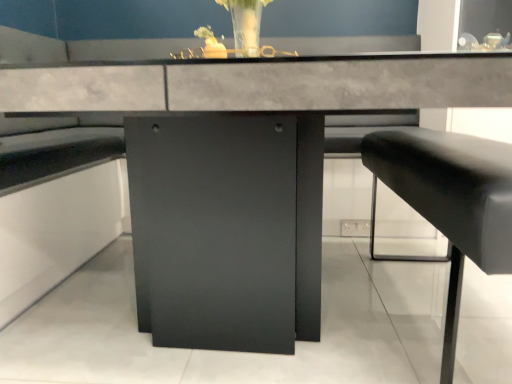
Question: From the image's perspective, is translucent glass vase at upper center above or below black leather cushion at right?

Choices:
 (A) above
 (B) below

Answer: (A)

Question: Based on their sizes in the image, would you say translucent glass vase at upper center is bigger or smaller than black leather cushion at right?

Choices:
 (A) small
 (B) big

Answer: (A)

Question: From a real-world perspective, is translucent glass vase at upper center above or below black leather cushion at right?

Choices:
 (A) below
 (B) above

Answer: (B)

Question: Looking at the image, does black leather cushion at right seem bigger or smaller compared to translucent glass vase at upper center?

Choices:
 (A) big
 (B) small

Answer: (A)

Question: From the image's perspective, is black leather cushion at right located above or below translucent glass vase at upper center?

Choices:
 (A) above
 (B) below

Answer: (B)

Question: Visually, is black leather cushion at right positioned to the left or to the right of translucent glass vase at upper center?

Choices:
 (A) left
 (B) right

Answer: (B)

Question: Considering their positions, is black leather cushion at right located in front of or behind translucent glass vase at upper center?

Choices:
 (A) front
 (B) behind

Answer: (A)